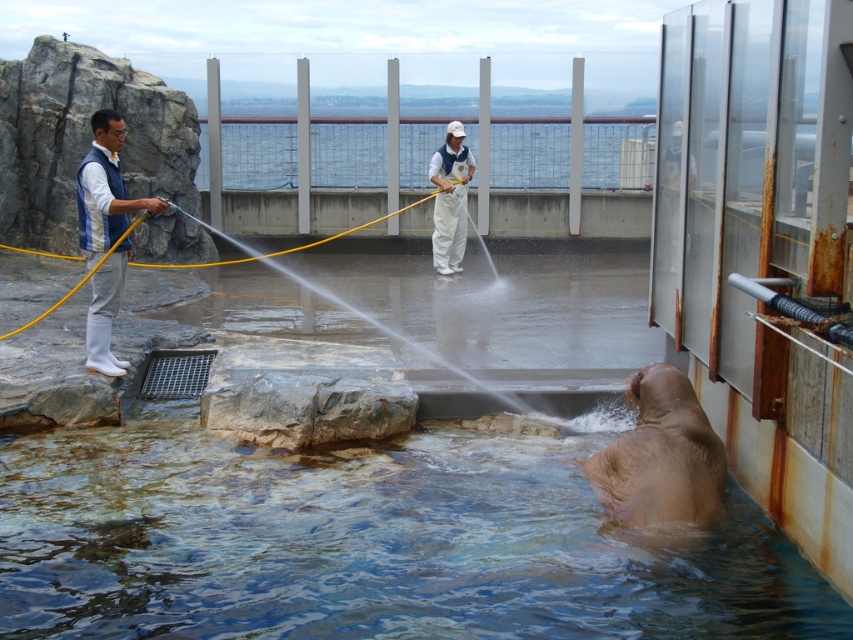
What do you see at coordinates (105, 188) in the screenshot? Image resolution: width=853 pixels, height=640 pixels. I see `white matte vest at left` at bounding box center [105, 188].

Is white matte vest at left above yellow rubber hose at left?

Actually, white matte vest at left is below yellow rubber hose at left.

Image resolution: width=853 pixels, height=640 pixels. I want to click on white matte vest at left, so click(x=105, y=188).

The width and height of the screenshot is (853, 640). In order to click on white matte vest at left in this screenshot , I will do `click(105, 188)`.

Who is positioned more to the left, white matte uniform at center or yellow rubber hose at left?

From the viewer's perspective, yellow rubber hose at left appears more on the left side.

Does point (444, 193) come closer to viewer compared to point (155, 262)?

Yes, point (444, 193) is closer to viewer.

Find the location of `white matte uniform at center`. white matte uniform at center is located at coordinates [450, 198].

Is clear water at lower center closer to the viewer compared to white matte uniform at center?

Yes, it is in front of white matte uniform at center.

Is point (85, 604) closer to viewer compared to point (468, 179)?

That is True.

Does point (749, 620) lie behind point (440, 268)?

That is False.

Identify the location of clear water at lower center. [x=368, y=541].